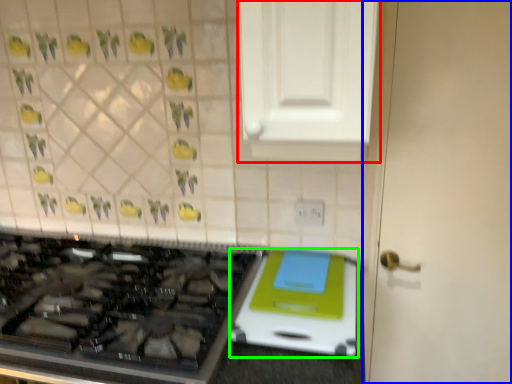
Question: Based on their relative distances, which object is nearer to cabinetry (highlighted by a red box)? Choose from door (highlighted by a blue box) and appliance (highlighted by a green box).

Choices:
 (A) door
 (B) appliance

Answer: (A)